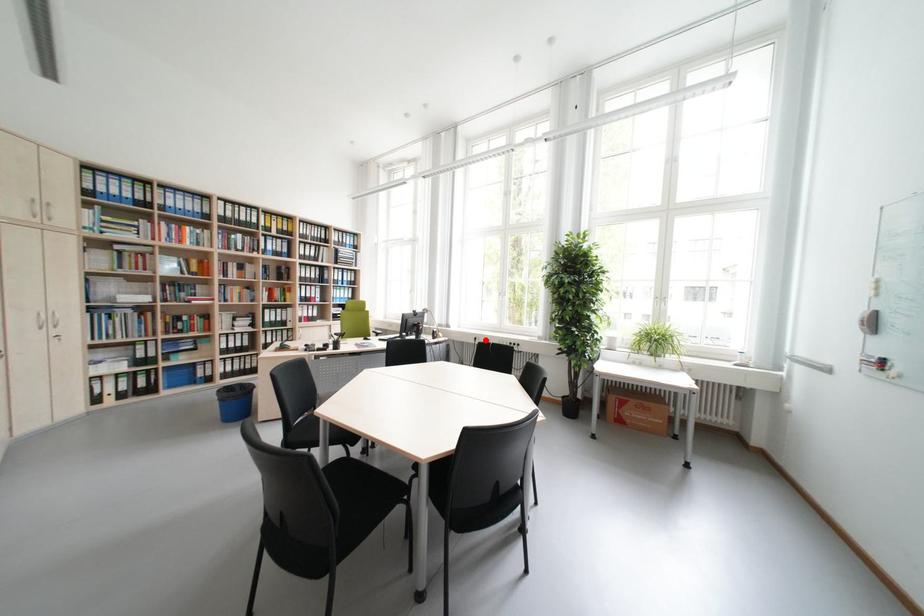
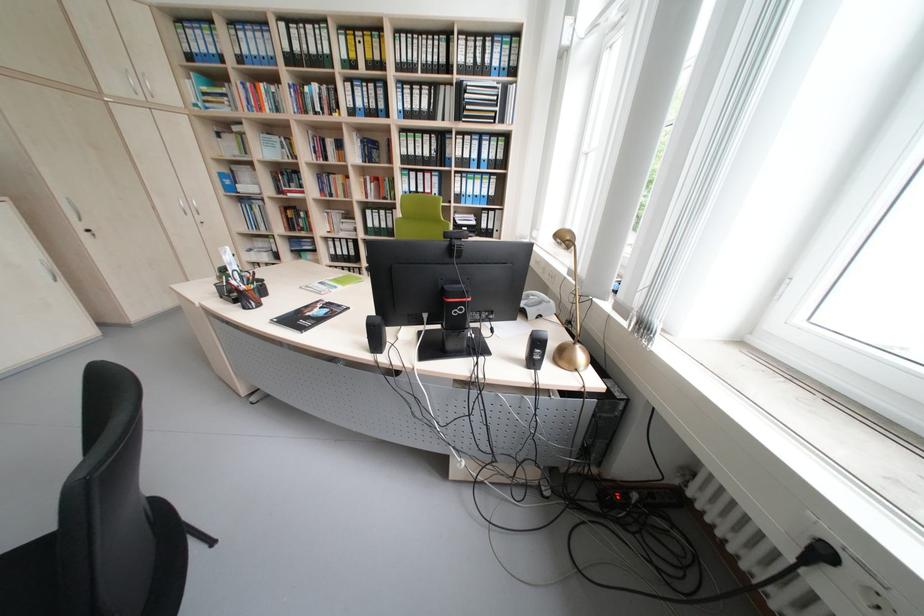
Where in the second image is the point corresponding to the highlighted location from the first image?

(833, 554)